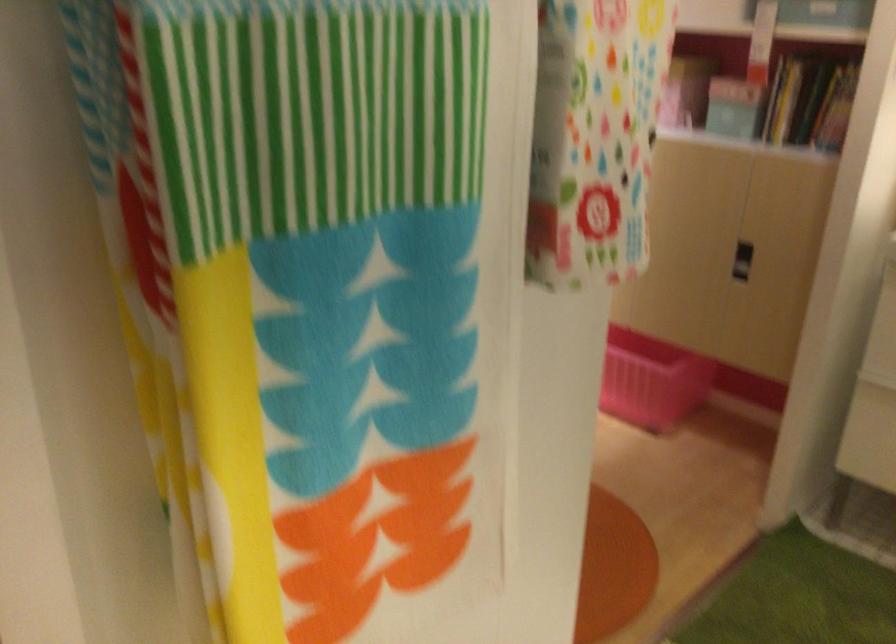
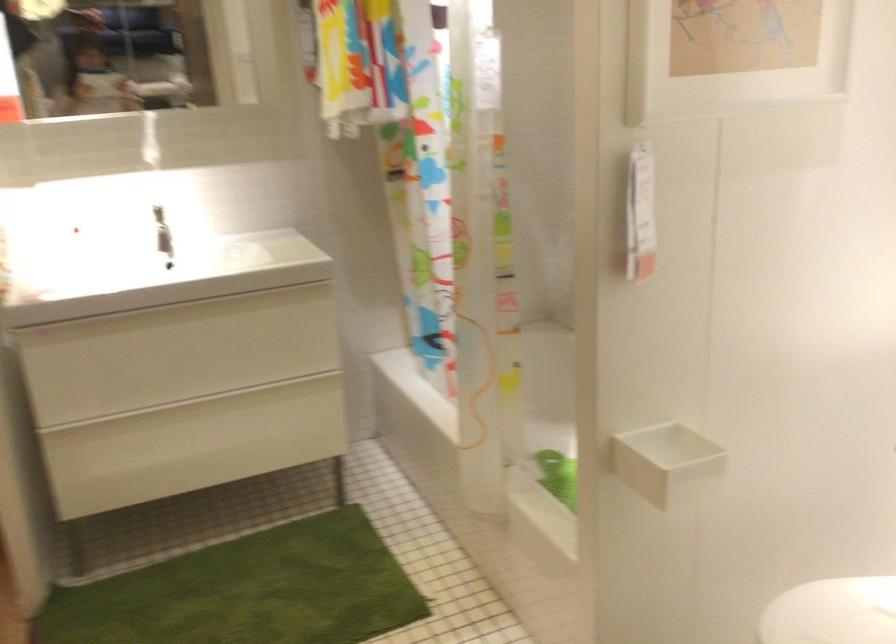
Question: The images are taken continuously from a first-person perspective. In which direction is your viewpoint rotating?

Choices:
 (A) Left
 (B) Right
 (C) Up
 (D) Down

Answer: (B)